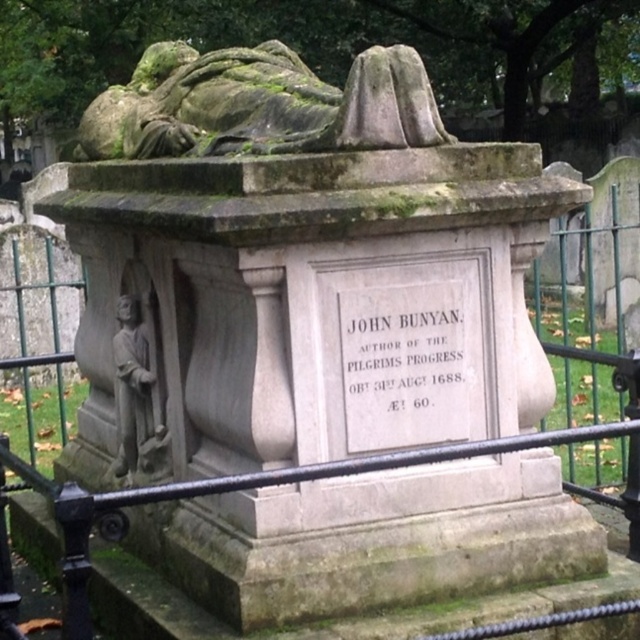
You are an art conservator assessing the stone monument. You notice two elements, the green mossy stone sculpture at upper center and the stone statue at left. Which of these two elements is bigger in size?

The green mossy stone sculpture at upper center is larger in size than the stone statue at left.

You are standing at the base of the monument and looking up at the green mossy stone sculpture at upper center. What are the coordinates of the sculpture in the image?

The coordinates of the green mossy stone sculpture at upper center are at point [259,104].

You are a visitor at the cemetery and want to take a photo of the stone statue at left without the black metal fence at center blocking the view. Is the fence taller than the statue?

The black metal fence at center is taller than the stone statue at left, so it may block the view if positioned between you and the statue.